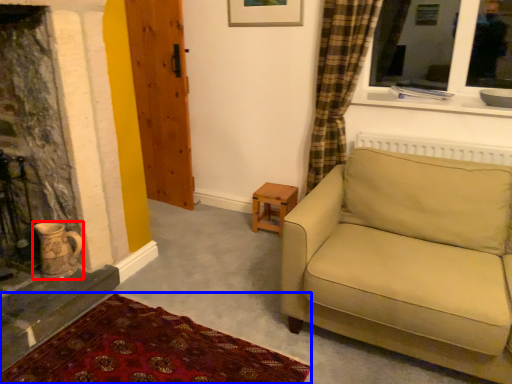
Question: Which point is further to the camera, tea pot (highlighted by a red box) or plain (highlighted by a blue box)?

Choices:
 (A) tea pot
 (B) plain

Answer: (A)